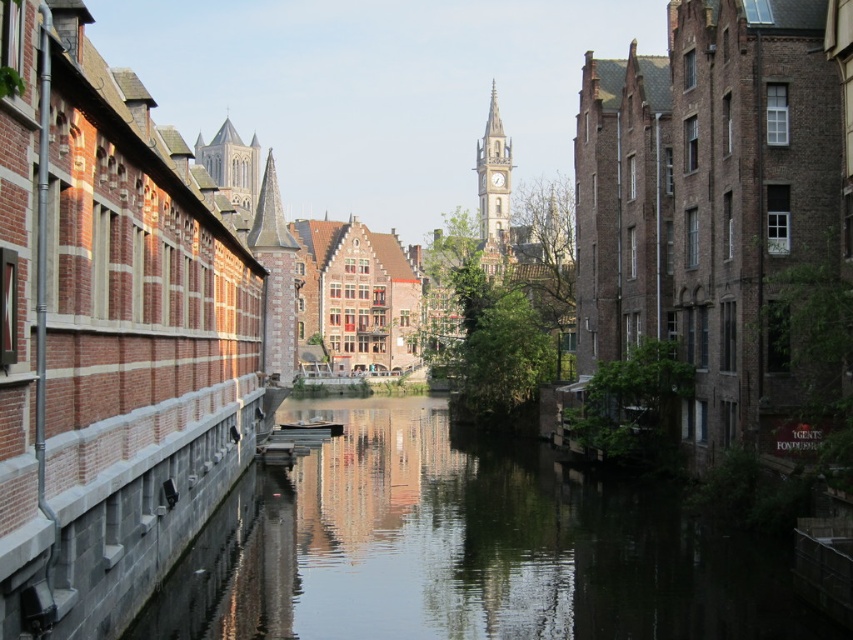
Question: Can you confirm if stone clock tower at center is thinner than smooth stone tower at upper center?

Choices:
 (A) yes
 (B) no

Answer: (A)

Question: Which point is farther to the camera?

Choices:
 (A) smooth concrete water at center
 (B) stone clock tower at center

Answer: (B)

Question: Which point is closer to the camera taking this photo?

Choices:
 (A) (315, 468)
 (B) (483, 244)

Answer: (A)

Question: Does smooth concrete water at center have a greater width compared to smooth stone tower at upper center?

Choices:
 (A) no
 (B) yes

Answer: (A)

Question: Does smooth concrete water at center appear on the right side of smooth stone tower at upper center?

Choices:
 (A) no
 (B) yes

Answer: (B)

Question: Which point appears farthest from the camera in this image?

Choices:
 (A) (495, 237)
 (B) (656, 593)
 (C) (209, 164)

Answer: (A)